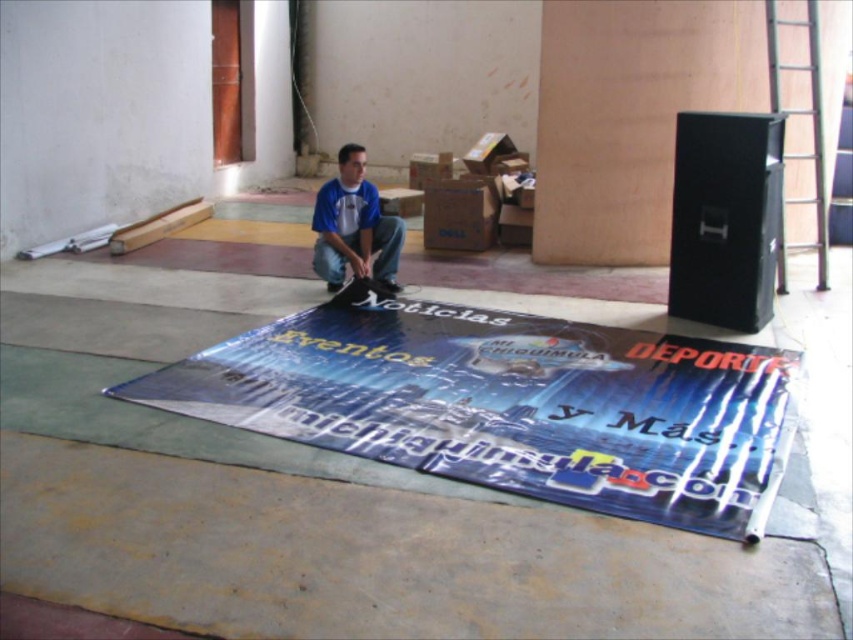
Is point (349, 364) positioned behind point (751, 232)?

No, (349, 364) is closer to viewer.

Image resolution: width=853 pixels, height=640 pixels. What do you see at coordinates (511, 404) in the screenshot?
I see `shiny plastic poster at center` at bounding box center [511, 404].

You are a GUI agent. You are given a task and a screenshot of the screen. Output one action in this format:
    pyautogui.click(x=<x>, y=<y>)
    Task: Click on the shiny plastic poster at center
    The height and width of the screenshot is (640, 853).
    Given the screenshot: What is the action you would take?
    pyautogui.click(x=511, y=404)

How far apart are shiny plastic poster at center and blue cotton shirt at center?

They are 1.50 meters apart.

Which of these two, shiny plastic poster at center or blue cotton shirt at center, stands taller?

With more height is blue cotton shirt at center.

Is point (746, 403) farther from viewer compared to point (392, 272)?

That is False.

I want to click on shiny plastic poster at center, so click(511, 404).

Which of these two, black matte speaker at upper right or blue cotton shirt at center, stands shorter?

Standing shorter between the two is blue cotton shirt at center.

Can you confirm if black matte speaker at upper right is taller than blue cotton shirt at center?

Yes, black matte speaker at upper right is taller than blue cotton shirt at center.

Locate an element on the screen. This screenshot has width=853, height=640. black matte speaker at upper right is located at coordinates (724, 218).